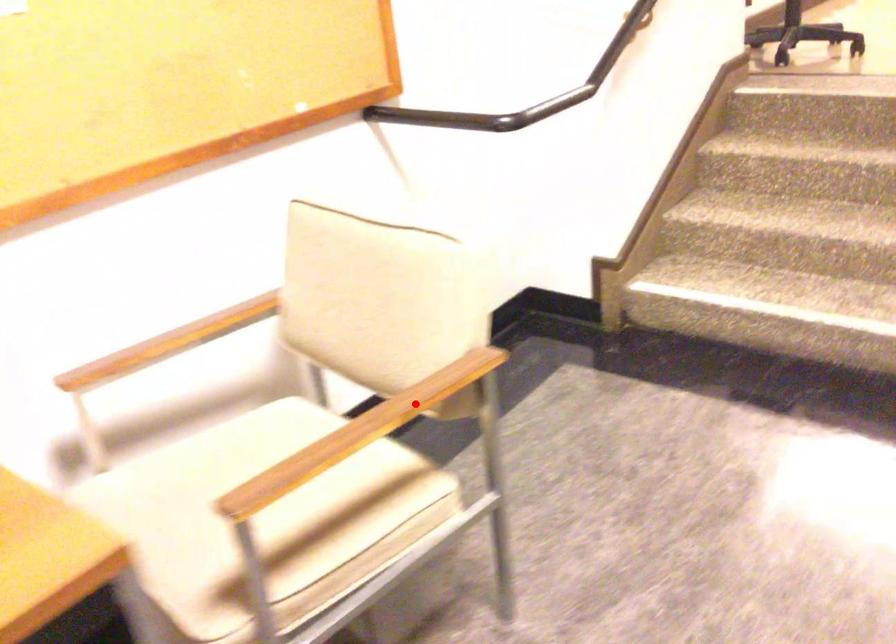
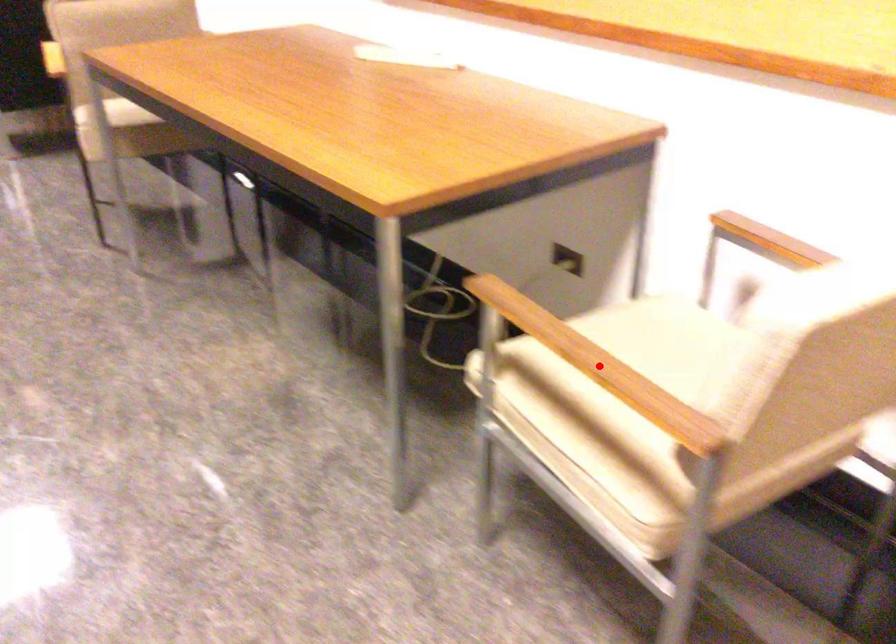
I am providing you with two images of the same scene from different viewpoints. A red point is marked on the first image and another point is marked on the second image. Do the highlighted points in image1 and image2 indicate the same real-world spot?

Yes